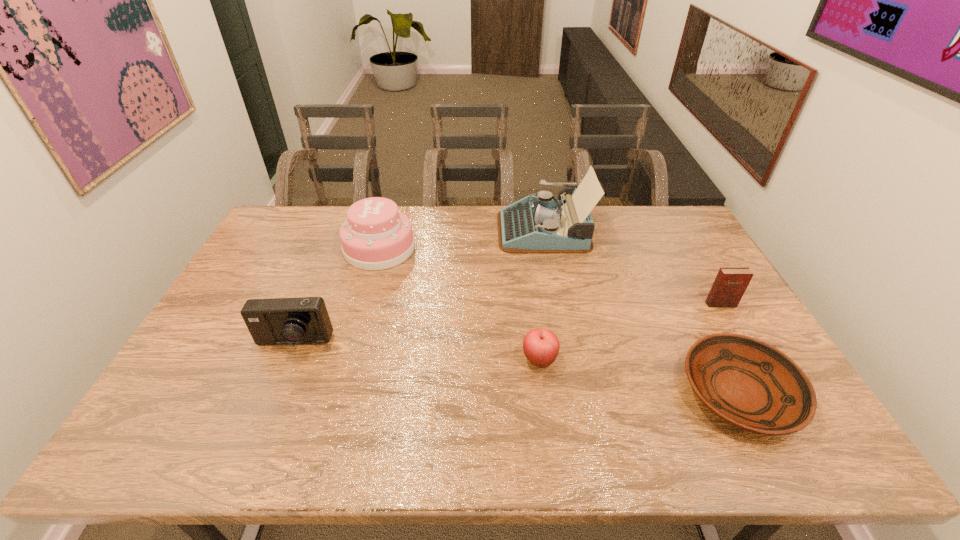
Identify the location of blank region between the fourth nearest object and the apple. This screenshot has height=540, width=960. (630, 332).

The width and height of the screenshot is (960, 540). I want to click on free space between the apple and the birthday cake, so click(x=460, y=304).

Find the location of a particular element. Image resolution: width=960 pixels, height=540 pixels. free space between the birthday cake and the camera is located at coordinates (337, 296).

Locate an element on the screen. This screenshot has height=540, width=960. free spot between the fifth tallest object and the diary is located at coordinates (630, 332).

Find the location of a particular element. object that is the fifth closest to the diary is located at coordinates click(304, 320).

Identify which object is located as the nearest to the typewriter. Please provide its 2D coordinates. Your answer should be formatted as a tuple, i.e. [(x, y)], where the tuple contains the x and y coordinates of a point satisfying the conditions above.

[(376, 236)]

Locate an element on the screen. This screenshot has width=960, height=540. vacant space that satisfies the following two spatial constraints: 1. on the front-facing side of the shortest object; 2. on the left side of the camera is located at coordinates (273, 394).

You are a GUI agent. You are given a task and a screenshot of the screen. Output one action in this format:
    pyautogui.click(x=<x>, y=<y>)
    Task: Click on the vacant area in the image that satisfies the following two spatial constraints: 1. on the typing side of the typewriter; 2. on the front-facing side of the camera
    This screenshot has height=540, width=960.
    Given the screenshot: What is the action you would take?
    pyautogui.click(x=564, y=343)

At what (x,y) coordinates should I click in order to perform the action: click on vacant area that satisfies the following two spatial constraints: 1. on the typing side of the tallest object; 2. on the front-facing side of the camera. Please return your answer as a coordinate pair (x, y). Image resolution: width=960 pixels, height=540 pixels. Looking at the image, I should click on (564, 343).

Locate an element on the screen. The width and height of the screenshot is (960, 540). vacant point that satisfies the following two spatial constraints: 1. on the typing side of the tallest object; 2. on the front-facing side of the camera is located at coordinates (564, 343).